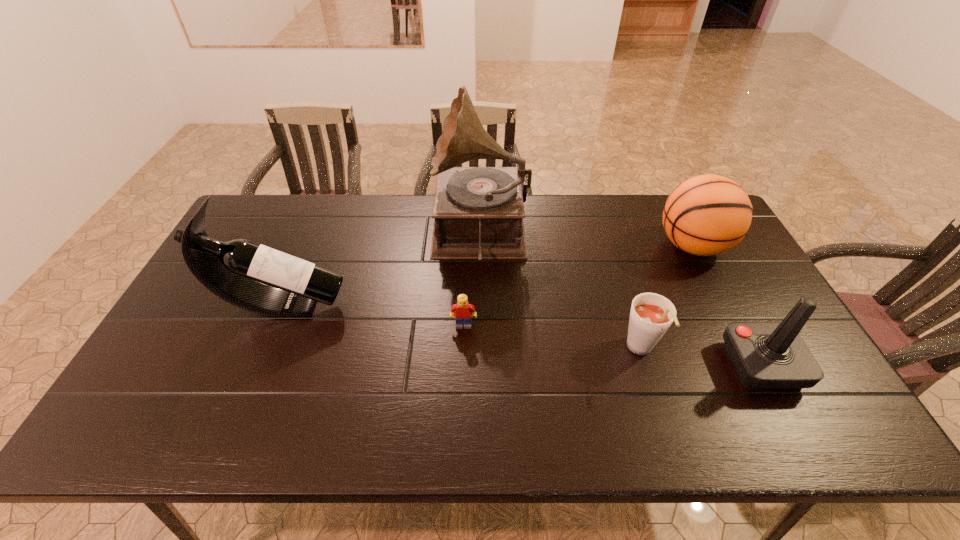
Where is `free point located 0.130m from the horn of the tallest object`? This screenshot has height=540, width=960. free point located 0.130m from the horn of the tallest object is located at coordinates (394, 235).

Find the location of a particular element. Image resolution: width=960 pixels, height=540 pixels. vacant space located 0.190m from the horn of the tallest object is located at coordinates (375, 235).

Find the location of `vacant space situated on the stand of the third farthest object`. vacant space situated on the stand of the third farthest object is located at coordinates (378, 306).

Identify the location of free space located on the left of the basketball. This screenshot has height=540, width=960. pyautogui.click(x=636, y=246).

I want to click on vacant space located 0.300m on the back of the joystick, so click(x=706, y=261).

Where is `vacant region located 0.100m on the drink side of the fourth object from left to right`? vacant region located 0.100m on the drink side of the fourth object from left to right is located at coordinates (660, 410).

The height and width of the screenshot is (540, 960). Identify the location of vacant region located on the front-facing side of the shortest object. (461, 419).

Where is `record player located in the far edge section of the desktop`? The height and width of the screenshot is (540, 960). record player located in the far edge section of the desktop is located at coordinates (478, 212).

This screenshot has height=540, width=960. Identify the location of basketball at the far edge. (705, 215).

Where is `object that is at the left edge`? object that is at the left edge is located at coordinates (234, 271).